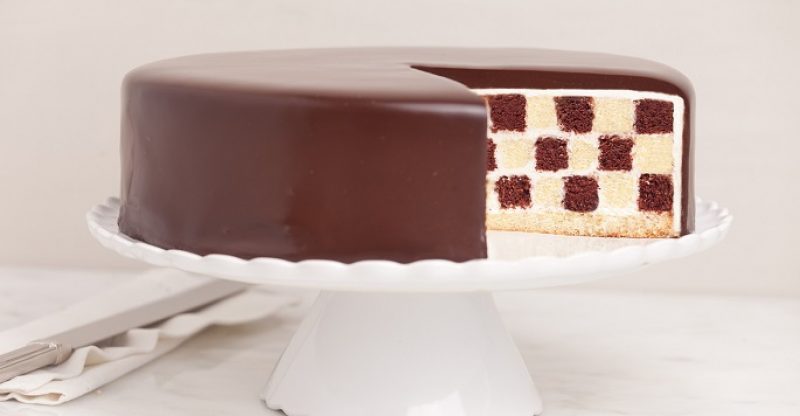
Where is `pedestal base of cake plate`? The width and height of the screenshot is (800, 416). pedestal base of cake plate is located at coordinates (397, 349).